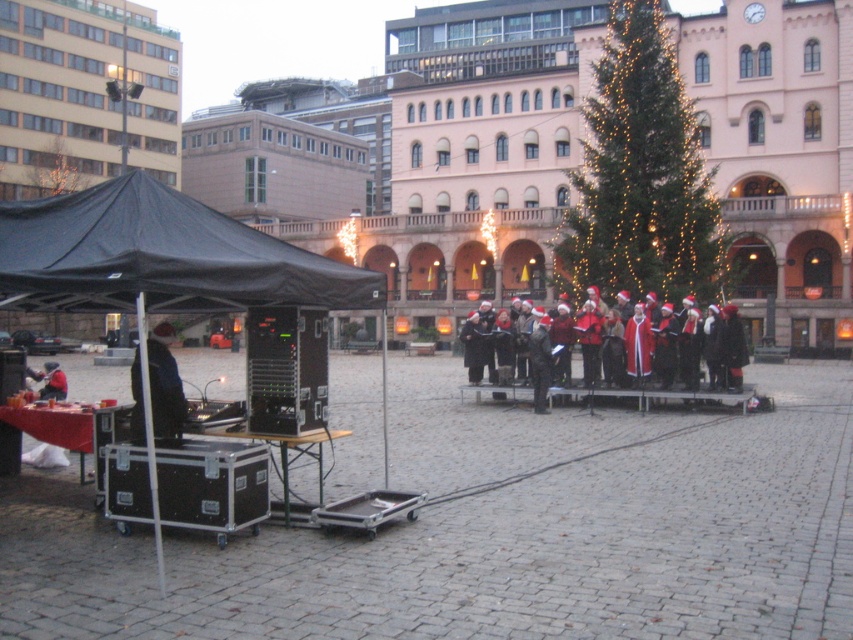
Is point (306, 275) farther from camera compared to point (645, 397)?

No, it is in front of (645, 397).

Consider the image. Does black fabric tent at left have a greater width compared to red velvet coat at center?

In fact, black fabric tent at left might be narrower than red velvet coat at center.

Between point (36, 284) and point (672, 339), which one is positioned in front?

Positioned in front is point (36, 284).

Locate an element on the screen. black fabric tent at left is located at coordinates (158, 266).

Is black fabric tent at left bigger than black fabric canopy at left?

Yes.

Between point (164, 288) and point (45, 259), which one is positioned behind?

Positioned behind is point (45, 259).

Where is `black fabric tent at left`? This screenshot has height=640, width=853. black fabric tent at left is located at coordinates (158, 266).

Locate an element on the screen. The width and height of the screenshot is (853, 640). black fabric tent at left is located at coordinates [x=158, y=266].

What do you see at coordinates (160, 257) in the screenshot? The width and height of the screenshot is (853, 640). I see `black fabric canopy at left` at bounding box center [160, 257].

Which is in front, point (73, 268) or point (744, 412)?

Positioned in front is point (73, 268).

You are a GUI agent. You are given a task and a screenshot of the screen. Output one action in this format:
    pyautogui.click(x=<x>, y=<y>)
    Task: Click on the black fabric canopy at left
    
    Given the screenshot: What is the action you would take?
    pyautogui.click(x=160, y=257)